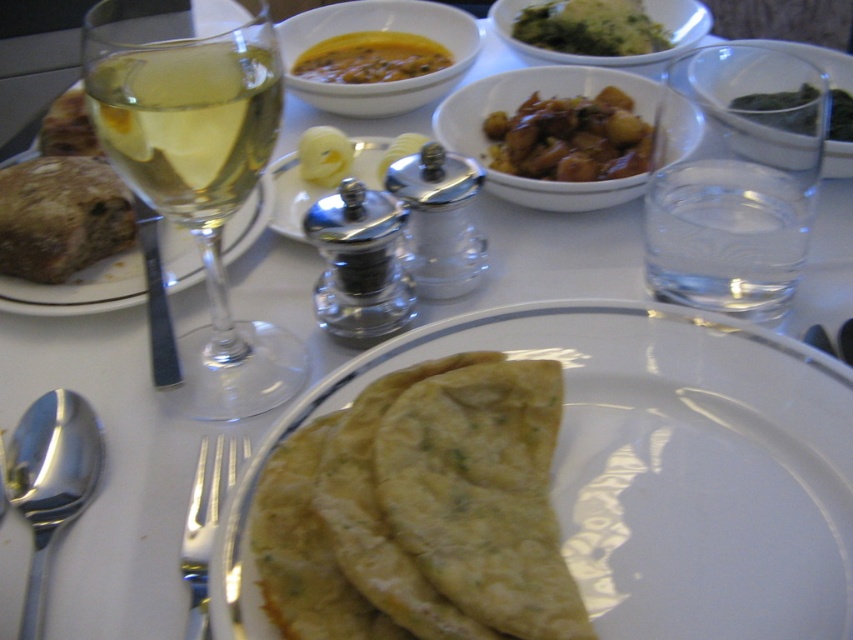
Between silver metallic spoon at left and matte glass wine at left, which one has more height?

With more height is matte glass wine at left.

Does silver metallic spoon at left have a smaller size compared to matte glass wine at left?

Yes.

Identify the location of silver metallic spoon at left. (50, 483).

Between green leafy vegetable at upper right and satin silver butter at center, which one has less height?

satin silver butter at center

Is point (850, 122) less distant than point (395, 148)?

No, (850, 122) is behind (395, 148).

Locate an element on the screen. green leafy vegetable at upper right is located at coordinates (781, 108).

Does green leafy vegetables at center have a lesser width compared to yellow creamy soup at center?

Indeed, green leafy vegetables at center has a lesser width compared to yellow creamy soup at center.

Does green leafy vegetables at center appear under yellow creamy soup at center?

Incorrect, green leafy vegetables at center is not positioned below yellow creamy soup at center.

Between point (645, 33) and point (399, 56), which one is positioned behind?

Point (399, 56)

The image size is (853, 640). I want to click on green leafy vegetables at center, so click(590, 28).